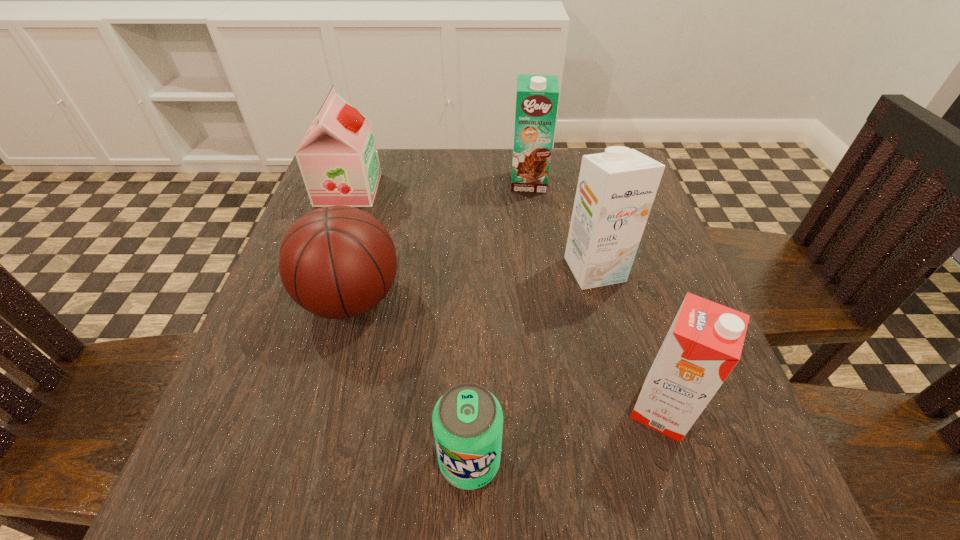
Locate an element on the screen. The image size is (960, 540). free location at the near edge of the desktop is located at coordinates (378, 478).

What are the coordinates of `vacant position at the left edge of the desktop` in the screenshot? It's located at (306, 345).

Identify the location of vacant space at the right edge of the desktop. Image resolution: width=960 pixels, height=540 pixels. [669, 288].

Where is `free space between the fourth object from right to left and the nearest carton`? The image size is (960, 540). free space between the fourth object from right to left and the nearest carton is located at coordinates (565, 435).

Find the location of a particular element. The image size is (960, 540). vacant region between the leftmost carton and the soya milk is located at coordinates (439, 186).

Find the location of a particular element. This screenshot has width=960, height=540. vacant space in between the shortest object and the nearest carton is located at coordinates (565, 435).

You are a GUI agent. You are given a task and a screenshot of the screen. Output one action in this format:
    pyautogui.click(x=<x>, y=<y>)
    Task: Click on the vacant area that lies between the shortest object and the soya milk
    
    Given the screenshot: What is the action you would take?
    pyautogui.click(x=409, y=325)

Locate an element on the screen. free space between the second farthest carton and the shortest object is located at coordinates (532, 365).

Locate an element on the screen. vacant space that is in between the pop soda and the second nearest carton is located at coordinates (532, 365).

Find the location of a particular element. The image size is (960, 540). unoccupied position between the third object from left to right and the second nearest carton is located at coordinates (532, 365).